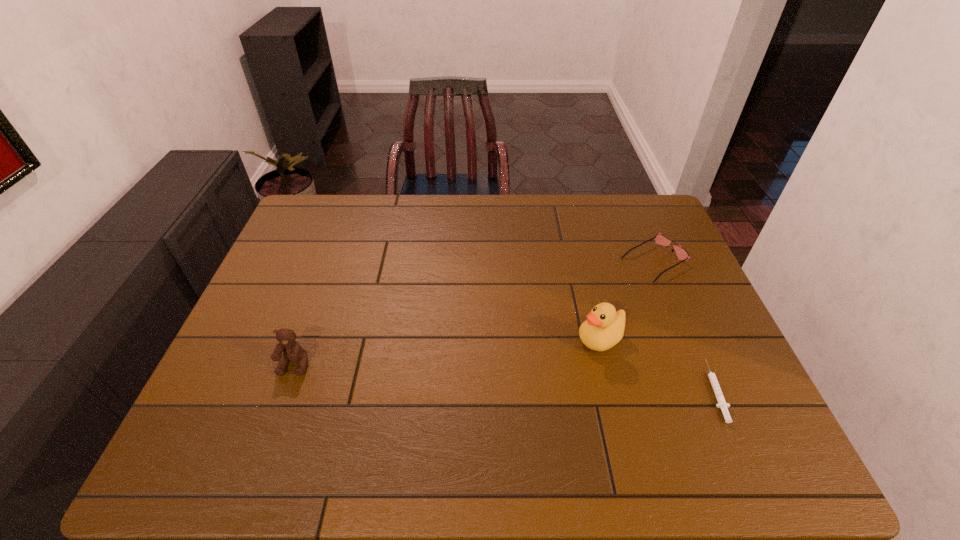
The image size is (960, 540). Identify the location of vacant space located 0.290m at the beak of the second object from left to right. (484, 397).

In order to click on vacant space situated 0.220m at the beak of the second object from left to right in this screenshot , I will do `click(510, 384)`.

This screenshot has width=960, height=540. I want to click on vacant space located on the bridge of the farthest object, so click(x=584, y=298).

Identify the location of vacant space positioned 0.360m on the bridge of the farthest object. (537, 323).

Find the location of `vacant area located 0.360m on the bridge of the farthest object`. vacant area located 0.360m on the bridge of the farthest object is located at coordinates click(537, 323).

Find the location of a particular element. object that is at the near edge is located at coordinates (722, 404).

This screenshot has width=960, height=540. I want to click on object that is at the left edge, so click(x=291, y=349).

Where is `syringe that is at the right edge`? syringe that is at the right edge is located at coordinates (722, 404).

The image size is (960, 540). In order to click on sunglasses present at the right edge in this screenshot , I will do `click(659, 238)`.

The height and width of the screenshot is (540, 960). What are the coordinates of `object situated at the near right corner` in the screenshot? It's located at (722, 404).